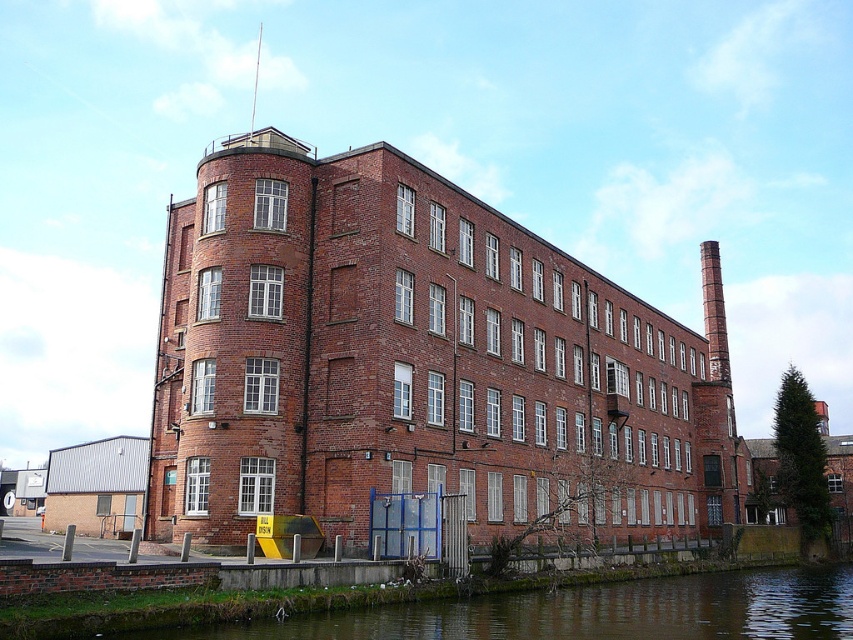
You are standing in front of the building and want to determine which of the two points, point (740,628) or point (720,353), is closer to you. Based on the building structure described, which point is nearer?

Point (740,628) is closer to the camera than point (720,353), so it is nearer to you.

Consider the image. You are standing in front of the building and want to place a new decorative plant pot between the green mossy stone at lower left and the red brick chimney at right. Based on their positions, where should you place the plant pot?

The green mossy stone at lower left is positioned under the red brick chimney at right, so placing the plant pot between them would require positioning it below the chimney and above the stone, maintaining their vertical alignment.

You are a drone operator tasked with capturing aerial footage of the building. Your drone has a maximum flight range of 60 meters. If you are currently positioned at the green mossy stone at lower left, can you fly the drone to the red brick chimney at right without exceeding its range?

The green mossy stone at lower left and red brick chimney at right are 60.09 meters apart from each other. Since the drone has a maximum flight range of 60 meters, it cannot reach the red brick chimney at right without exceeding its range.